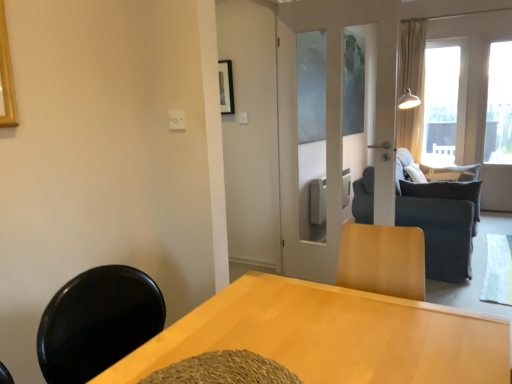
Question: Is dark gray fabric couch at center taller than transparent glass window at upper right, which appears as the second window when viewed from the right?

Choices:
 (A) no
 (B) yes

Answer: (A)

Question: From the image's perspective, is dark gray fabric couch at center on top of transparent glass window at upper right, marked as the first window in a left-to-right arrangement?

Choices:
 (A) yes
 (B) no

Answer: (B)

Question: Does dark gray fabric couch at center have a lesser width compared to transparent glass window at upper right, marked as the first window in a left-to-right arrangement?

Choices:
 (A) no
 (B) yes

Answer: (A)

Question: From a real-world perspective, is dark gray fabric couch at center under transparent glass window at upper right, marked as the first window in a left-to-right arrangement?

Choices:
 (A) yes
 (B) no

Answer: (A)

Question: Does dark gray fabric couch at center have a greater width compared to transparent glass window at upper right, marked as the first window in a left-to-right arrangement?

Choices:
 (A) yes
 (B) no

Answer: (A)

Question: Is transparent glass window at upper right, marked as the first window in a left-to-right arrangement, a part of dark gray fabric couch at center?

Choices:
 (A) yes
 (B) no

Answer: (B)

Question: Is transparent glass window at upper right, marked as the first window in a left-to-right arrangement, shorter than beige fabric curtain at right?

Choices:
 (A) yes
 (B) no

Answer: (A)

Question: Is transparent glass window at upper right, which appears as the second window when viewed from the right, positioned beyond the bounds of beige fabric curtain at right?

Choices:
 (A) yes
 (B) no

Answer: (A)

Question: Is transparent glass window at upper right, which appears as the second window when viewed from the right, surrounding beige fabric curtain at right?

Choices:
 (A) no
 (B) yes

Answer: (A)

Question: Is transparent glass window at upper right, marked as the first window in a left-to-right arrangement, wider than beige fabric curtain at right?

Choices:
 (A) yes
 (B) no

Answer: (B)

Question: Is transparent glass window at upper right, marked as the first window in a left-to-right arrangement, positioned in front of beige fabric curtain at right?

Choices:
 (A) no
 (B) yes

Answer: (A)

Question: From a real-world perspective, is transparent glass window at upper right, marked as the first window in a left-to-right arrangement, located beneath beige fabric curtain at right?

Choices:
 (A) no
 (B) yes

Answer: (B)

Question: Can you confirm if light wood table at center is taller than beige fabric curtain at right?

Choices:
 (A) yes
 (B) no

Answer: (B)